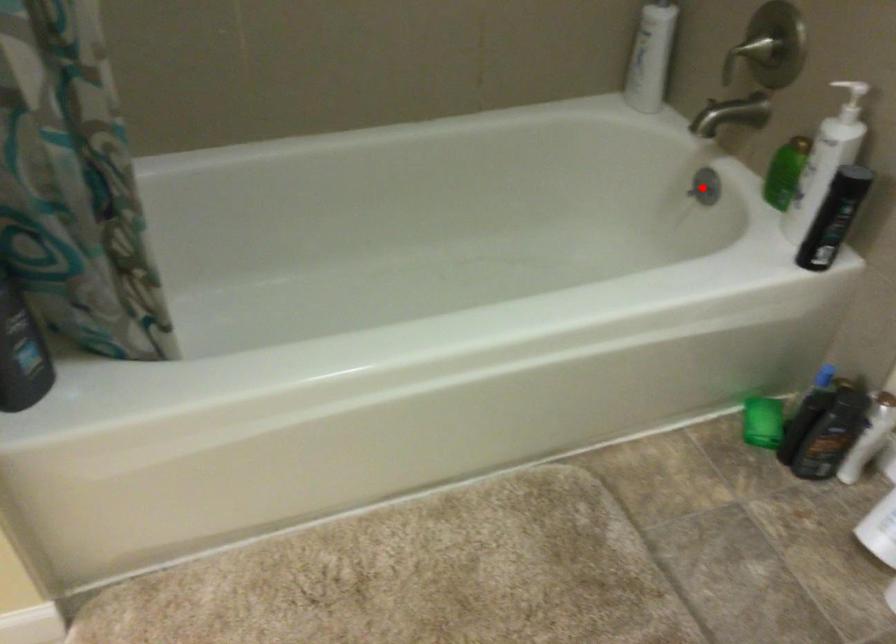
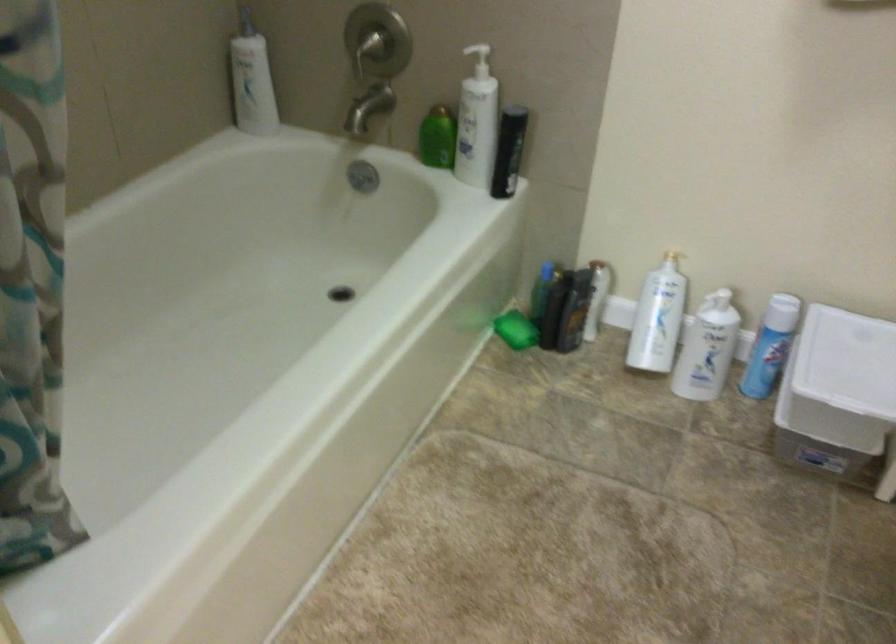
Find the pixel in the second image that matches the highlighted location in the first image.

(362, 176)